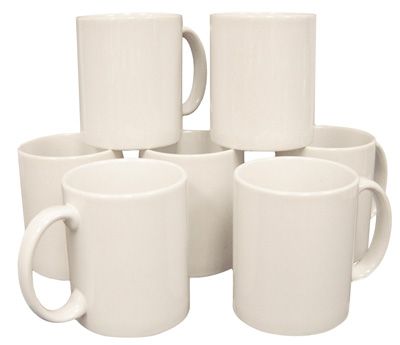
Locate an element on the screen. The height and width of the screenshot is (345, 400). mugs with handle visible is located at coordinates (155, 247), (151, 123), (278, 251), (349, 159).